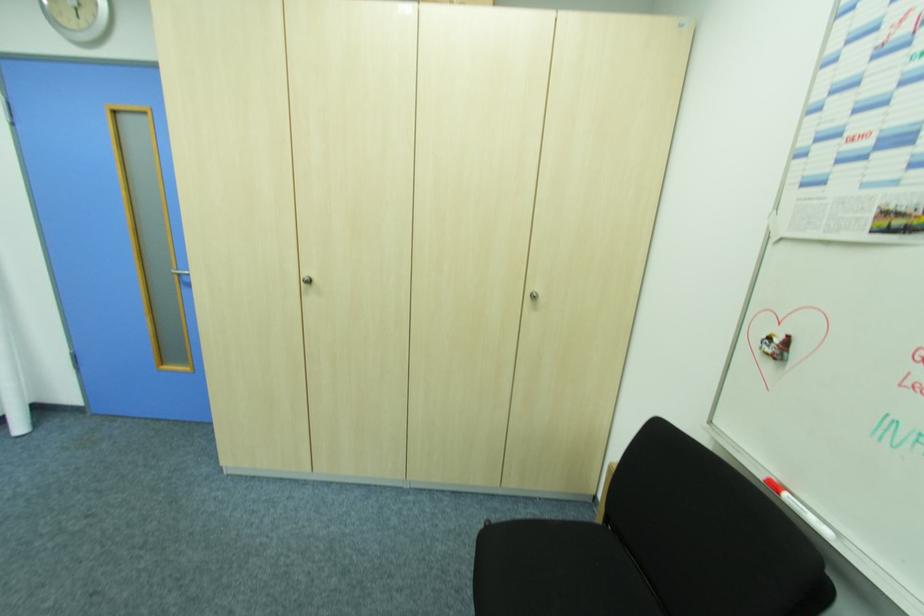
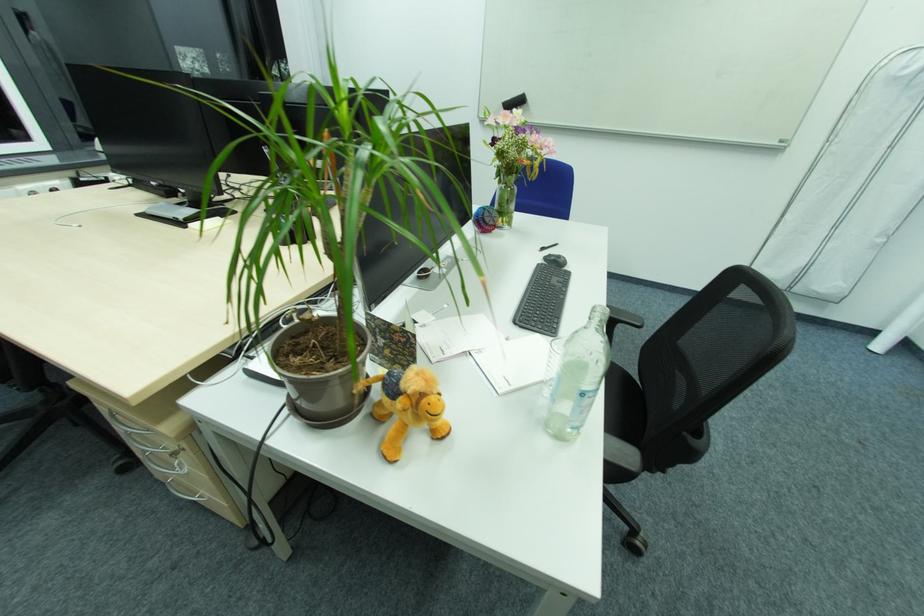
How did the camera likely rotate?

The camera's rotation is toward left-down.